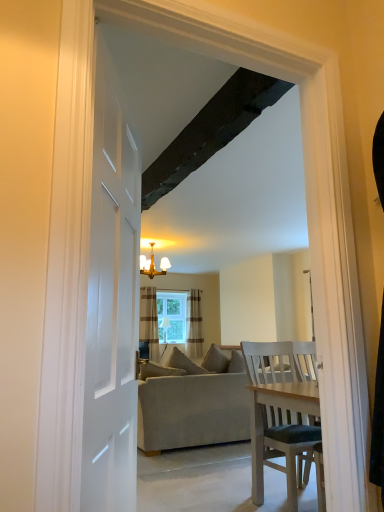
What do you see at coordinates (211, 130) in the screenshot? I see `dark wood beam at upper center` at bounding box center [211, 130].

Image resolution: width=384 pixels, height=512 pixels. Describe the element at coordinates (193, 410) in the screenshot. I see `beige fabric couch at center` at that location.

What is the approximate width of brown striped curtain at center, the first curtain from the left?

8.97 inches.

This screenshot has height=512, width=384. What are the coordinates of `gold metallic chandelier at upper center` in the screenshot? It's located at (153, 265).

Based on their sizes in the image, would you say brown striped curtain at center, acting as the second curtain starting from the right, is bigger or smaller than gold metallic chandelier at upper center?

In the image, brown striped curtain at center, acting as the second curtain starting from the right, appears to be larger than gold metallic chandelier at upper center.

Considering the relative positions of brown striped curtain at center, acting as the second curtain starting from the right, and gold metallic chandelier at upper center in the image provided, is brown striped curtain at center, acting as the second curtain starting from the right, to the left or to the right of gold metallic chandelier at upper center?

In the image, brown striped curtain at center, acting as the second curtain starting from the right, appears on the left side of gold metallic chandelier at upper center.

Locate an element on the screen. This screenshot has width=384, height=512. light fixture located above the brown striped curtain at center, acting as the second curtain starting from the right (from the image's perspective) is located at coordinates (153, 265).

From the picture: Is brown striped curtain at center, the first curtain from the left, wider or thinner than gold metallic chandelier at upper center?

Clearly, brown striped curtain at center, the first curtain from the left, has less width compared to gold metallic chandelier at upper center.

Considering the positions of objects clear glass window at center and dark wood beam at upper center in the image provided, who is more to the left, clear glass window at center or dark wood beam at upper center?

From the viewer's perspective, clear glass window at center appears more on the left side.

Can you see clear glass window at center touching dark wood beam at upper center?

clear glass window at center and dark wood beam at upper center are not in contact.

Considering the sizes of objects clear glass window at center and dark wood beam at upper center in the image provided, who is taller, clear glass window at center or dark wood beam at upper center?

clear glass window at center.

Measure the distance from clear glass window at center to dark wood beam at upper center.

clear glass window at center and dark wood beam at upper center are 19.97 feet apart.

Between dark wood beam at upper center and gold metallic chandelier at upper center, which one appears on the right side from the viewer's perspective?

Positioned to the right is dark wood beam at upper center.

Between dark wood beam at upper center and gold metallic chandelier at upper center, which one has smaller width?

gold metallic chandelier at upper center.

From the image's perspective, which one is positioned lower, dark wood beam at upper center or gold metallic chandelier at upper center?

gold metallic chandelier at upper center appears lower in the image.

This screenshot has height=512, width=384. What are the coordinates of `exhaust hood in front of the gold metallic chandelier at upper center` in the screenshot? It's located at (211, 130).

Considering the sizes of objects dark wood beam at upper center and clear glass window at center in the image provided, who is taller, dark wood beam at upper center or clear glass window at center?

Standing taller between the two is clear glass window at center.

Which object is more forward, dark wood beam at upper center or clear glass window at center?

dark wood beam at upper center is more forward.

Image resolution: width=384 pixels, height=512 pixels. I want to click on window that appears on the left of dark wood beam at upper center, so click(x=171, y=316).

From the image's perspective, which one is positioned higher, dark wood beam at upper center or clear glass window at center?

dark wood beam at upper center appears higher in the image.

Would you say striped fabric curtain at center, which ranks as the 2th curtain in left-to-right order, is inside or outside gold metallic chandelier at upper center?

The correct answer is: outside.

Considering the positions of objects striped fabric curtain at center, which ranks as the 2th curtain in left-to-right order, and gold metallic chandelier at upper center in the image provided, who is more to the left, striped fabric curtain at center, which ranks as the 2th curtain in left-to-right order, or gold metallic chandelier at upper center?

Positioned to the left is gold metallic chandelier at upper center.

Relative to gold metallic chandelier at upper center, is striped fabric curtain at center, which ranks as the 1th curtain in right-to-left order, in front or behind?

Clearly, striped fabric curtain at center, which ranks as the 1th curtain in right-to-left order, is behind gold metallic chandelier at upper center.

Is the surface of striped fabric curtain at center, which ranks as the 1th curtain in right-to-left order, in direct contact with gold metallic chandelier at upper center?

No, striped fabric curtain at center, which ranks as the 1th curtain in right-to-left order, is not making contact with gold metallic chandelier at upper center.

Looking at this image, from a real-world perspective, is beige fabric couch at center located higher than clear glass window at center?

Incorrect, from a real-world perspective, beige fabric couch at center is lower than clear glass window at center.

Choose the correct answer: Is beige fabric couch at center inside clear glass window at center or outside it?

beige fabric couch at center is spatially situated outside clear glass window at center.

Consider the image. Considering the relative positions of beige fabric couch at center and clear glass window at center in the image provided, is beige fabric couch at center to the right of clear glass window at center from the viewer's perspective?

Yes, beige fabric couch at center is to the right of clear glass window at center.

Is point (225, 380) positioned behind point (175, 303)?

No, it is in front of (175, 303).

How far apart are clear glass window at center and striped fabric curtain at center, which ranks as the 1th curtain in right-to-left order?

The distance of clear glass window at center from striped fabric curtain at center, which ranks as the 1th curtain in right-to-left order, is 29.34 centimeters.

Are clear glass window at center and striped fabric curtain at center, which ranks as the 2th curtain in left-to-right order, located far from each other?

No, there isn't a large distance between clear glass window at center and striped fabric curtain at center, which ranks as the 2th curtain in left-to-right order.

Can you confirm if clear glass window at center is positioned to the left of striped fabric curtain at center, which ranks as the 2th curtain in left-to-right order?

Yes, clear glass window at center is to the left of striped fabric curtain at center, which ranks as the 2th curtain in left-to-right order.

This screenshot has height=512, width=384. Identify the location of the 1st curtain located beneath the gold metallic chandelier at upper center (from a real-world perspective). 149,321.

This screenshot has width=384, height=512. I want to click on exhaust hood above the clear glass window at center (from the image's perspective), so click(211, 130).

In the scene shown: When comparing their distances from brown striped curtain at center, acting as the second curtain starting from the right, does beige fabric couch at center or dark wood beam at upper center seem further?

dark wood beam at upper center.

When comparing their distances from gold metallic chandelier at upper center, does striped fabric curtain at center, which ranks as the 1th curtain in right-to-left order, or beige fabric couch at center seem closer?

striped fabric curtain at center, which ranks as the 1th curtain in right-to-left order, is closer to gold metallic chandelier at upper center.

Estimate the real-world distances between objects in this image. Which object is closer to dark wood beam at upper center, striped fabric curtain at center, which ranks as the 1th curtain in right-to-left order, or beige fabric couch at center?

beige fabric couch at center.

Looking at the image, which one is located closer to gold metallic chandelier at upper center, beige fabric couch at center or dark wood beam at upper center?

beige fabric couch at center is positioned closer to the anchor gold metallic chandelier at upper center.

Which object lies further to the anchor point striped fabric curtain at center, which ranks as the 1th curtain in right-to-left order, gold metallic chandelier at upper center or beige fabric couch at center?

beige fabric couch at center is positioned further to the anchor striped fabric curtain at center, which ranks as the 1th curtain in right-to-left order.

Based on their spatial positions, is brown striped curtain at center, acting as the second curtain starting from the right, or gold metallic chandelier at upper center further from clear glass window at center?

gold metallic chandelier at upper center is further to clear glass window at center.

Which object lies nearer to the anchor point clear glass window at center, gold metallic chandelier at upper center or beige fabric couch at center?

gold metallic chandelier at upper center.

Considering their positions, is beige fabric couch at center positioned further to brown striped curtain at center, acting as the second curtain starting from the right, than gold metallic chandelier at upper center?

The object further to brown striped curtain at center, acting as the second curtain starting from the right, is beige fabric couch at center.

Locate an element on the screen. light fixture located between dark wood beam at upper center and clear glass window at center in the depth direction is located at coordinates (153, 265).

Where is `light fixture positioned between beige fabric couch at center and clear glass window at center from near to far`? light fixture positioned between beige fabric couch at center and clear glass window at center from near to far is located at coordinates (153, 265).

Where is `light fixture between dark wood beam at upper center and brown striped curtain at center, the first curtain from the left, in the front-back direction`? The image size is (384, 512). light fixture between dark wood beam at upper center and brown striped curtain at center, the first curtain from the left, in the front-back direction is located at coordinates (153, 265).

The image size is (384, 512). Find the location of `light fixture between beige fabric couch at center and striped fabric curtain at center, which ranks as the 2th curtain in left-to-right order, along the z-axis`. light fixture between beige fabric couch at center and striped fabric curtain at center, which ranks as the 2th curtain in left-to-right order, along the z-axis is located at coordinates (153, 265).